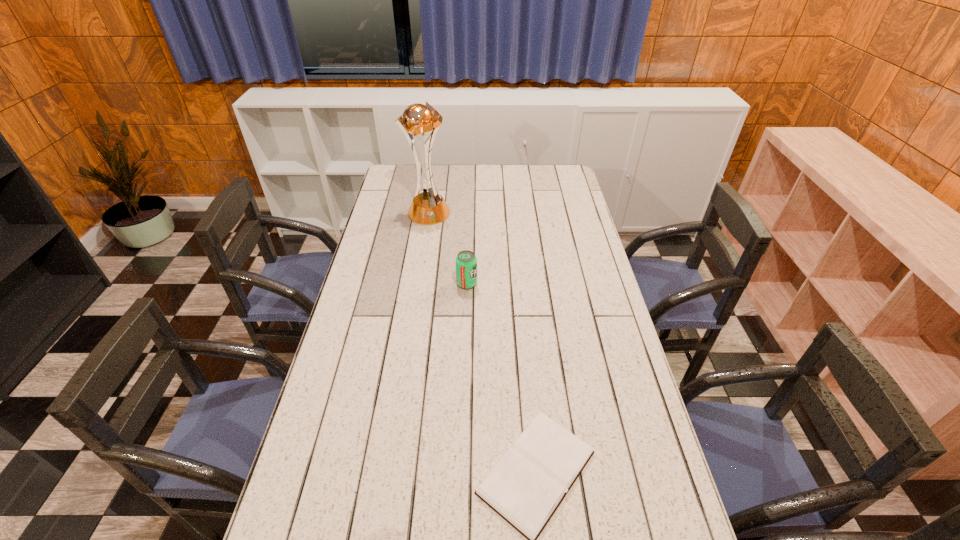
Identify the location of the leftmost object. The width and height of the screenshot is (960, 540). (427, 208).

Find the location of a particular element. the farthest object is located at coordinates pyautogui.click(x=427, y=208).

I want to click on the second farthest object, so click(x=466, y=262).

I want to click on pop soda, so click(x=466, y=262).

The height and width of the screenshot is (540, 960). I want to click on free space located 0.230m on the front-facing side of the trophy, so click(x=420, y=260).

Where is `vacant space situated 0.320m on the front-facing side of the second tallest object`? vacant space situated 0.320m on the front-facing side of the second tallest object is located at coordinates (566, 284).

In order to click on object that is positioned at the left edge in this screenshot , I will do `click(427, 208)`.

Where is `free point at the far edge`? Image resolution: width=960 pixels, height=540 pixels. free point at the far edge is located at coordinates (468, 176).

The height and width of the screenshot is (540, 960). In order to click on blank space at the left edge of the desktop in this screenshot , I will do point(353,368).

The height and width of the screenshot is (540, 960). Identify the location of vacant space at the right edge of the desktop. [x=594, y=293].